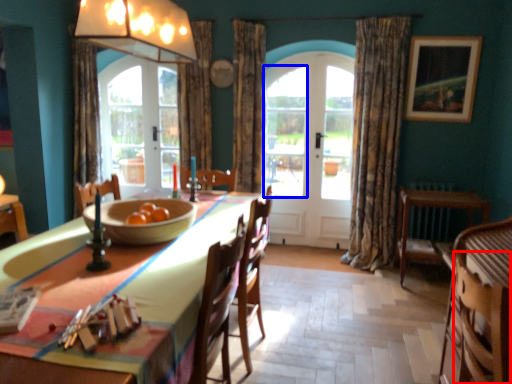
Question: Among these objects, which one is farthest to the camera, armchair (highlighted by a red box) or window (highlighted by a blue box)?

Choices:
 (A) armchair
 (B) window

Answer: (B)